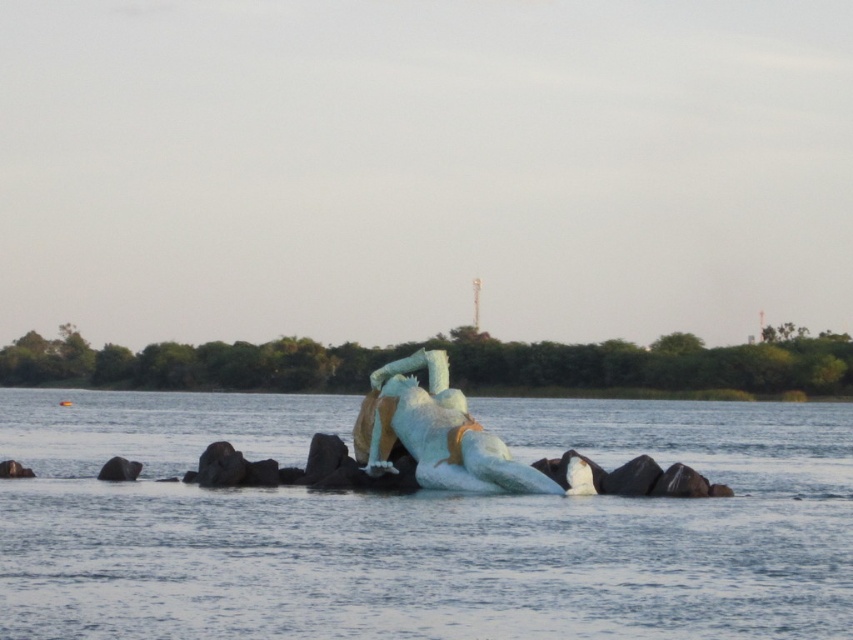
Who is taller, translucent white water at center or white matte sculpture at center?

translucent white water at center is taller.

Can you confirm if translucent white water at center is positioned to the left of white matte sculpture at center?

Yes, translucent white water at center is to the left of white matte sculpture at center.

Where is `translucent white water at center`? translucent white water at center is located at coordinates (421, 525).